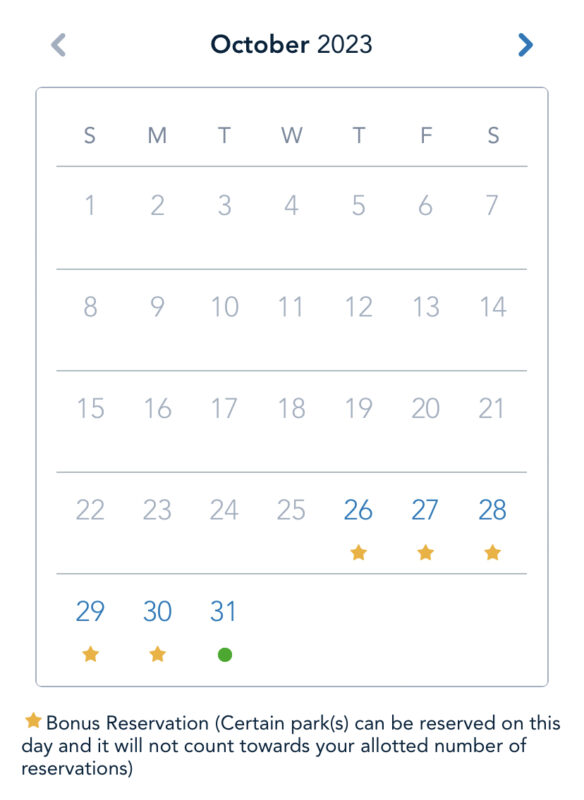
Where is `gray box border around calendar`? The height and width of the screenshot is (800, 584). gray box border around calendar is located at coordinates (403, 686).